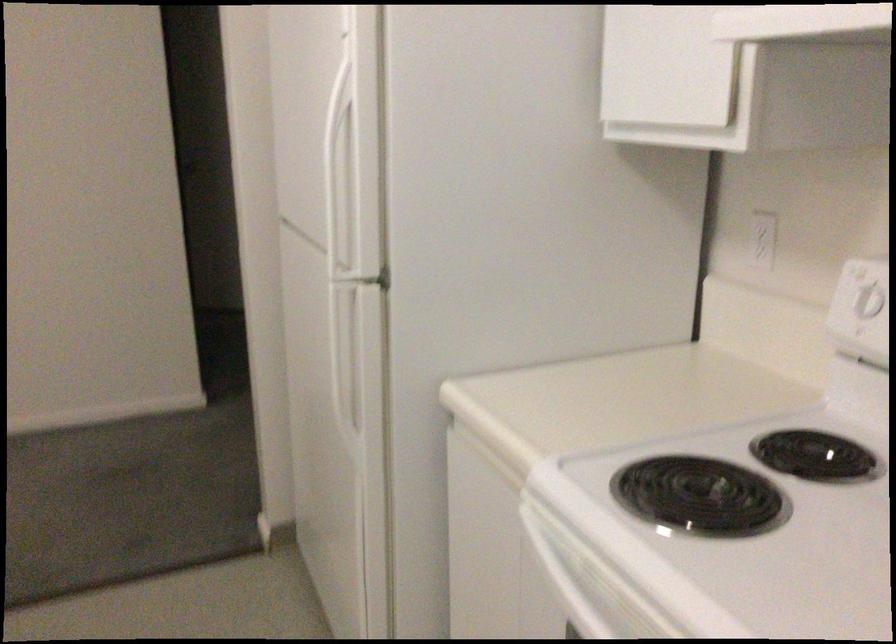
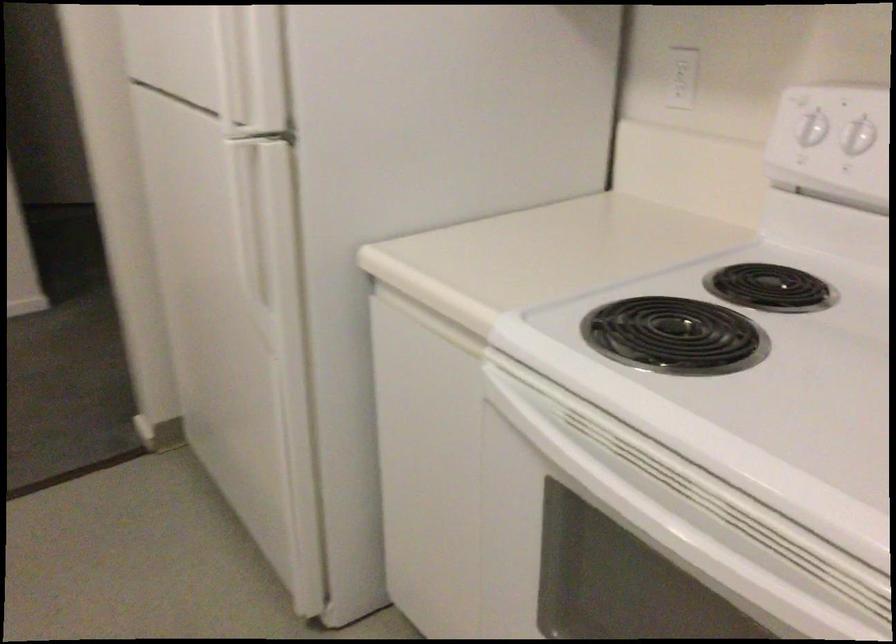
Question: The first image is from the beginning of the video and the second image is from the end. How did the camera likely rotate when shooting the video?

Choices:
 (A) Left
 (B) Right
 (C) Up
 (D) Down

Answer: (B)